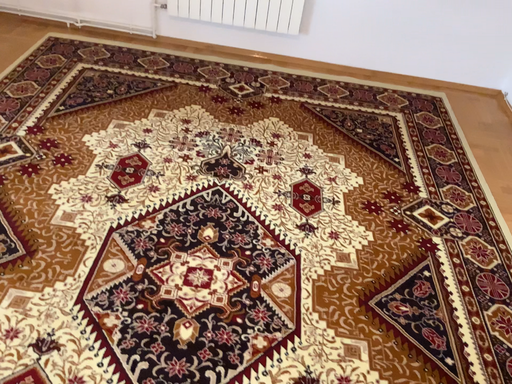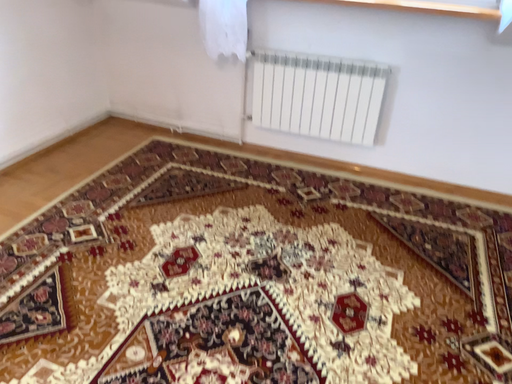
Question: How did the camera likely rotate when shooting the video?

Choices:
 (A) rotated upward
 (B) rotated downward

Answer: (A)